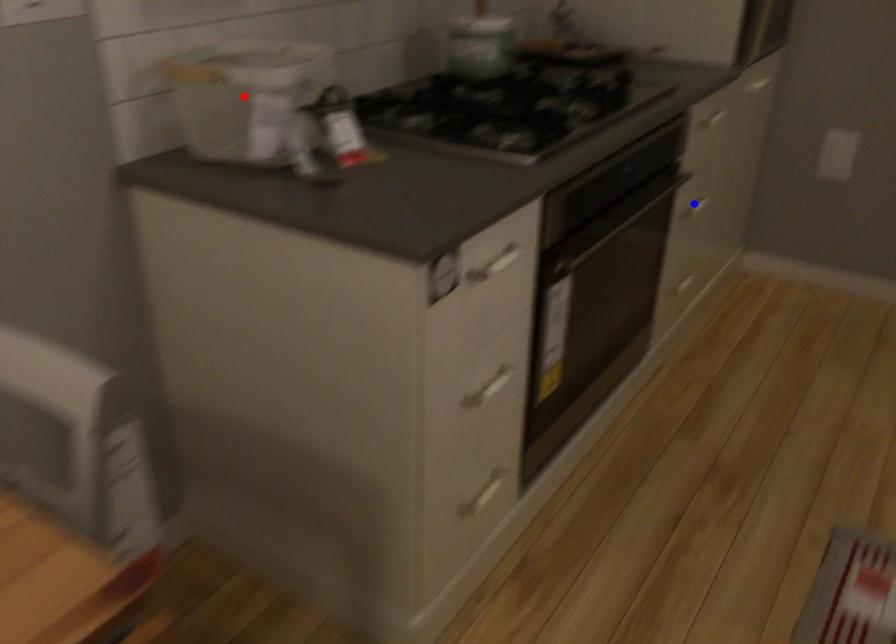
Question: Two points are marked on the image. Which point is closer to the camera?

Choices:
 (A) Blue point is closer.
 (B) Red point is closer.

Answer: (B)